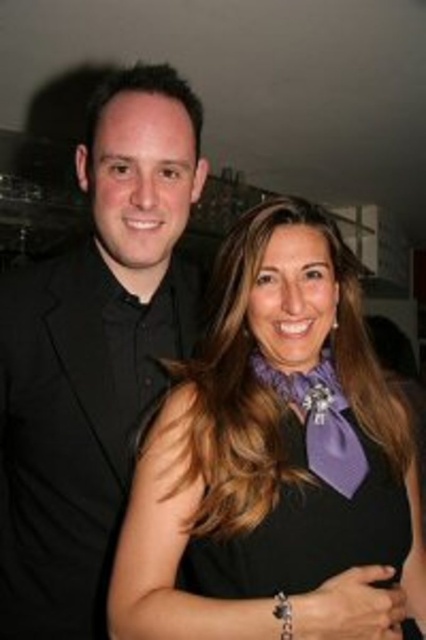
Does purple satin scarf at center have a lesser width compared to purple satin tie at center?

Incorrect, purple satin scarf at center's width is not less than purple satin tie at center's.

Looking at this image, is purple satin scarf at center bigger than purple satin tie at center?

Yes, purple satin scarf at center is bigger than purple satin tie at center.

Which is behind, point (350, 492) or point (328, 454)?

Positioned behind is point (328, 454).

Identify the location of purple satin scarf at center. The image size is (426, 640). (276, 461).

Between purple satin scarf at center and black matte suit at left, which one has less height?

With less height is purple satin scarf at center.

Who is more distant from viewer, (256, 214) or (175, 138)?

Positioned behind is point (256, 214).

I want to click on purple satin scarf at center, so click(x=276, y=461).

Can you confirm if black matte suit at left is positioned to the left of purple satin dress at center?

Yes, black matte suit at left is to the left of purple satin dress at center.

Who is higher up, black matte suit at left or purple satin dress at center?

black matte suit at left

Where is `black matte suit at left`? black matte suit at left is located at coordinates (94, 355).